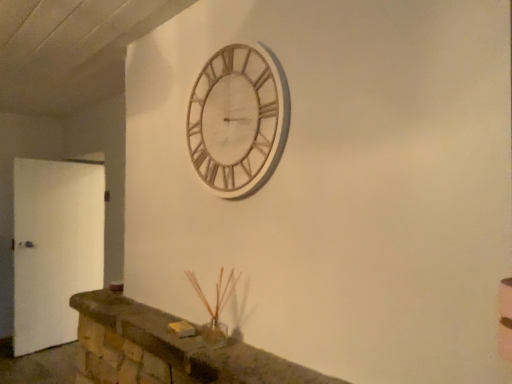
Question: Is white matte door at left in front of or behind wooden clock at upper center in the image?

Choices:
 (A) front
 (B) behind

Answer: (B)

Question: In terms of size, does white matte door at left appear bigger or smaller than wooden clock at upper center?

Choices:
 (A) big
 (B) small

Answer: (A)

Question: Which is farther from the wooden clock at upper center?

Choices:
 (A) brown stone mantle at lower center
 (B) white matte door at left

Answer: (B)

Question: Based on their relative distances, which object is nearer to the white matte door at left?

Choices:
 (A) brown stone mantle at lower center
 (B) wooden clock at upper center

Answer: (A)